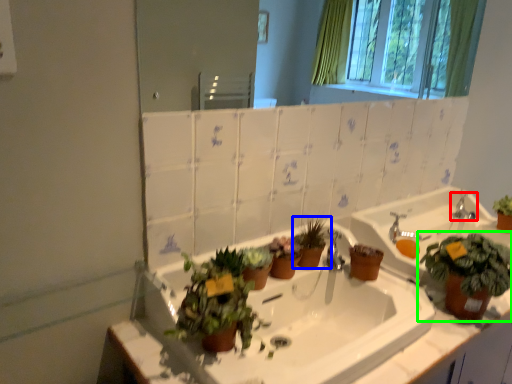
Question: Estimate the real-world distances between objects in this image. Which object is closer to tap (highlighted by a red box), houseplant (highlighted by a blue box) or houseplant (highlighted by a green box)?

Choices:
 (A) houseplant
 (B) houseplant

Answer: (B)